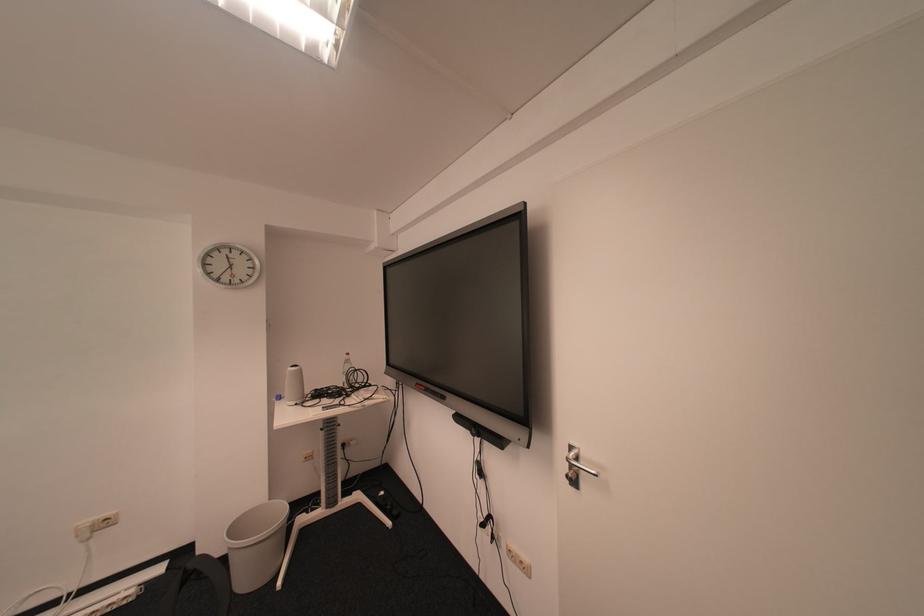
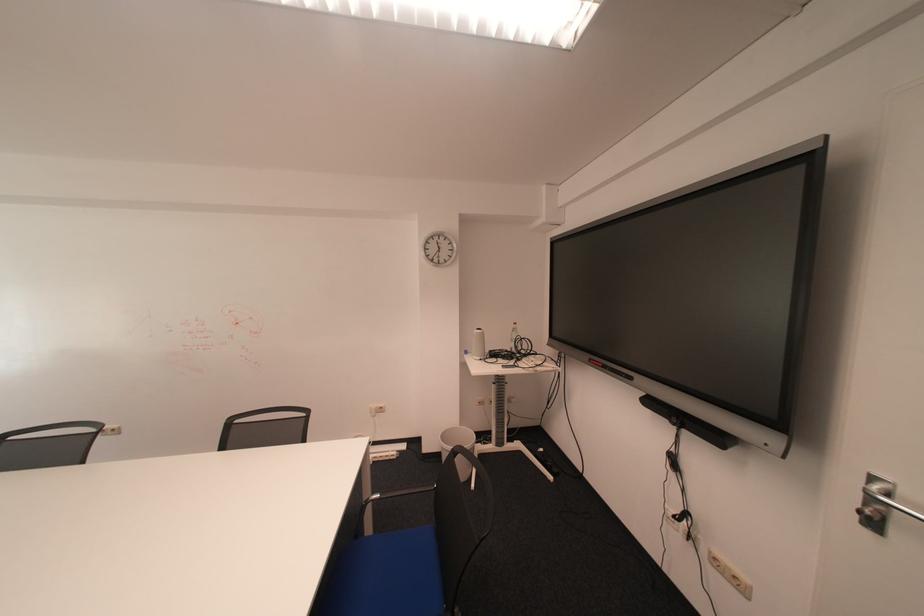
Where in the second image is the point corresponding to (89,528) from the first image?

(382, 408)